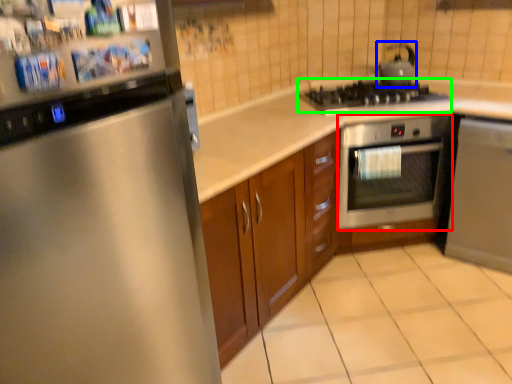
Question: Estimate the real-world distances between objects in this image. Which object is farther from oven (highlighted by a red box), tea pot (highlighted by a blue box) or gas stove (highlighted by a green box)?

Choices:
 (A) tea pot
 (B) gas stove

Answer: (A)